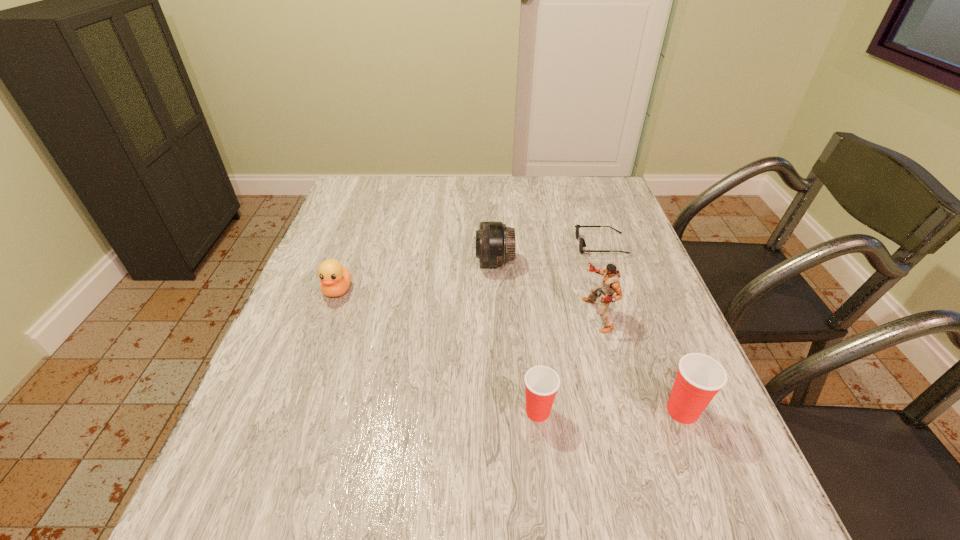
The height and width of the screenshot is (540, 960). In order to click on vacant area located 0.350m on the front-facing side of the shortest object in this screenshot , I will do `click(453, 245)`.

Locate an element on the screen. vacant region located on the front-facing side of the telephoto lens is located at coordinates (369, 262).

Locate an element on the screen. Image resolution: width=960 pixels, height=540 pixels. vacant area located 0.150m on the front-facing side of the telephoto lens is located at coordinates (420, 262).

The width and height of the screenshot is (960, 540). Find the location of `vacant space positioned 0.280m on the front-facing side of the telephoto lens`. vacant space positioned 0.280m on the front-facing side of the telephoto lens is located at coordinates (372, 262).

At what (x,y) coordinates should I click in order to perform the action: click on vacant region located 0.160m on the front-facing side of the puncher. Please return your answer as a coordinate pair (x, y). This screenshot has height=540, width=960. Looking at the image, I should click on (516, 315).

Identify the location of vacant point located 0.120m on the front-facing side of the puncher. (532, 315).

The width and height of the screenshot is (960, 540). What are the coordinates of `vacant space located 0.360m on the front-facing side of the puncher` in the screenshot? It's located at (430, 315).

You are a GUI agent. You are given a task and a screenshot of the screen. Output one action in this format:
    pyautogui.click(x=<x>, y=<y>)
    Task: Click on the free spot located 0.330m on the face of the leftmost object
    
    Given the screenshot: What is the action you would take?
    pyautogui.click(x=288, y=428)

At what (x,y) coordinates should I click in order to perform the action: click on object at the left edge. Please return your answer as a coordinate pair (x, y). The image size is (960, 540). Looking at the image, I should click on (335, 279).

Find the location of `Dixie cup at the right edge`. Dixie cup at the right edge is located at coordinates (699, 378).